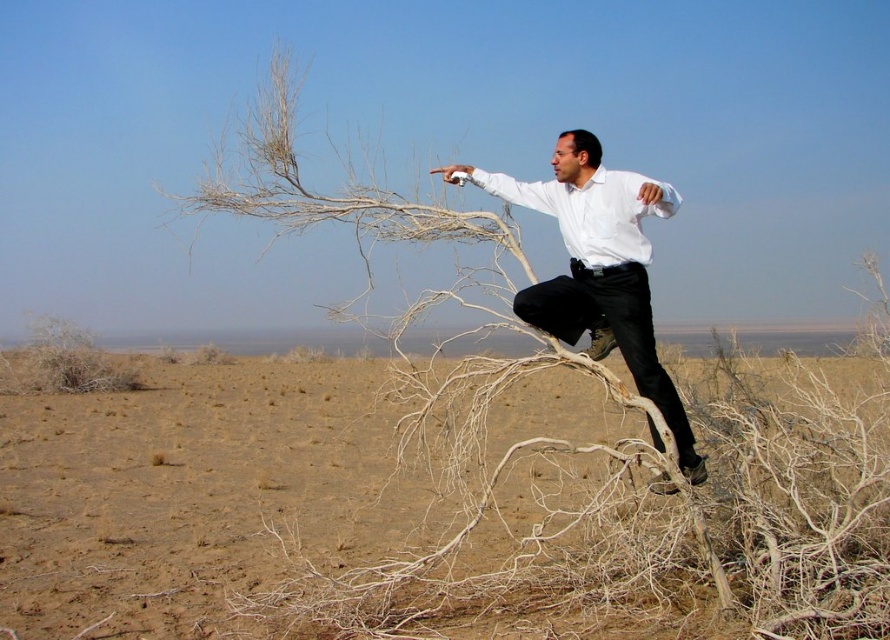
You are an archaeologist examining the scene. You notice the brown sandy dirt at center and the white matte shirt at center. Which object occupies a greater area in the image?

The brown sandy dirt at center is larger in size than the white matte shirt at center, so the brown sandy dirt at center occupies a greater area in the image.

You are a photographer trying to capture the man in the white matte dress shirt at center. Since the brown sandy dirt at center is in front of him, how might you adjust your camera angle to ensure he is clearly visible?

To ensure the white matte dress shirt at center is clearly visible, you should adjust your camera angle to avoid the brown sandy dirt at center, which is blocking the view. Position the camera so that the man is framed behind the dirt or move to a higher vantage point to look down past the dirt.

You are a drone operator trying to capture a photo of the white matte dress shirt at center from above. The drone has a maximum descent height of 10 meters. Can the drone safely descend to take the photo without crashing into the brown sandy dirt at center?

The distance between the white matte dress shirt at center and the brown sandy dirt at center is 12.07 meters. Since the drone can only descend to 10 meters, it cannot safely reach the required height to take the photo without crashing into the brown sandy dirt at center.